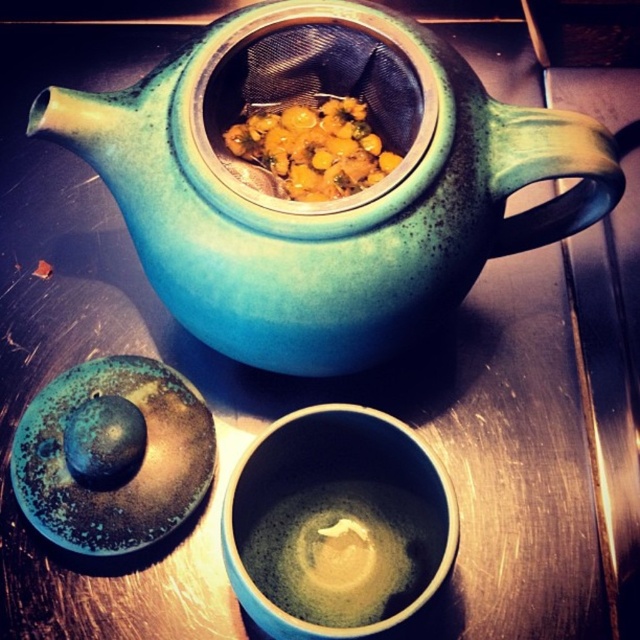
Who is more distant from viewer, (464, 209) or (381, 150)?

Point (381, 150)

Measure the distance between teal ceramic teapot at center and camera.

They are 27.22 inches apart.

Locate an element on the screen. teal ceramic teapot at center is located at coordinates (326, 200).

Does teal ceramic teapot at center have a larger size compared to smooth matte black tea at center?

Yes, teal ceramic teapot at center is bigger than smooth matte black tea at center.

Is teal ceramic teapot at center behind smooth matte black tea at center?

No, teal ceramic teapot at center is closer to the viewer.

Does point (396, 208) come farther from viewer compared to point (336, 596)?

That is False.

I want to click on teal ceramic teapot at center, so click(x=326, y=200).

What do you see at coordinates (344, 552) in the screenshot?
I see `smooth matte black tea at center` at bounding box center [344, 552].

Does smooth matte black tea at center come behind yellow-orange textured seeds at center?

No, it is not.

Which is in front, point (252, 579) or point (296, 186)?

Point (252, 579)

This screenshot has width=640, height=640. What are the coordinates of `smooth matte black tea at center` in the screenshot? It's located at (344, 552).